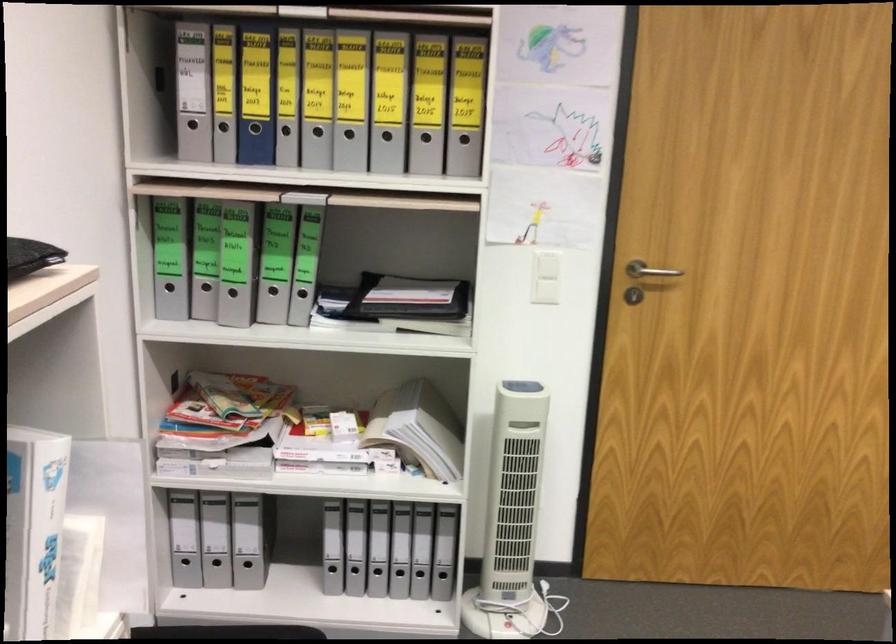
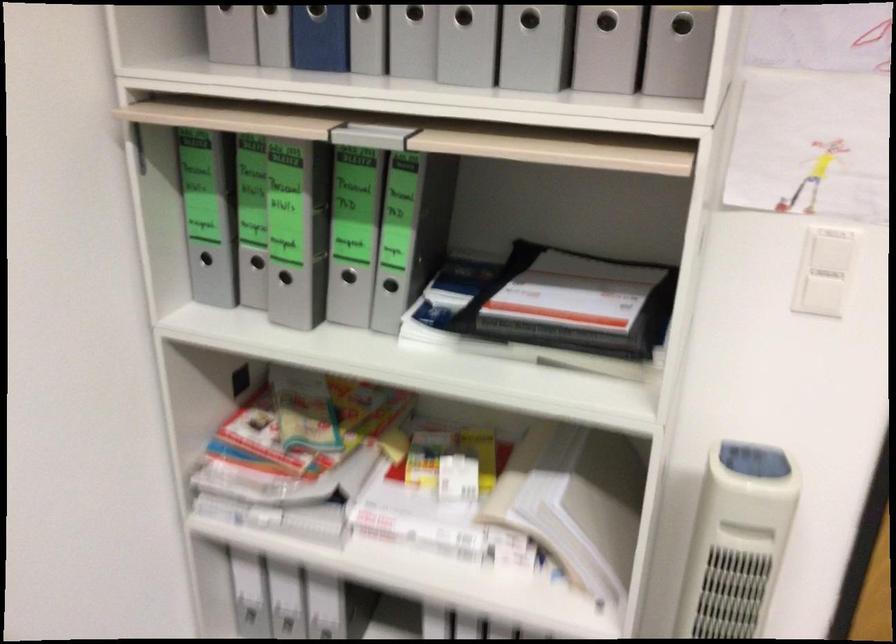
Question: Based on the continuous images, in which direction is the camera rotating? Reply with the corresponding letter.

Choices:
 (A) Left
 (B) Right
 (C) Up
 (D) Down

Answer: (A)